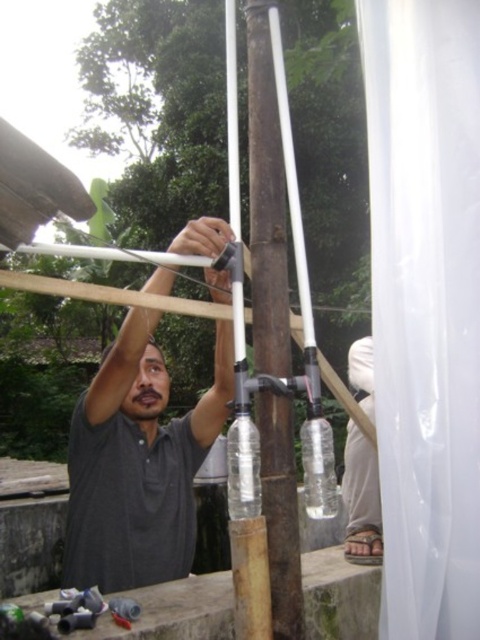
Question: Estimate the real-world distances between objects in this image. Which object is closer to the white sheer curtain at right?

Choices:
 (A) white plastic pole at center
 (B) dark gray shirt at center

Answer: (A)

Question: Which of the following is the farthest from the observer?

Choices:
 (A) dark gray skin at upper center
 (B) dark gray shirt at center
 (C) white sheer curtain at right
 (D) white plastic pole at center

Answer: (A)

Question: Does white sheer curtain at right appear under dark gray skin at upper center?

Choices:
 (A) no
 (B) yes

Answer: (A)

Question: Does dark gray shirt at center appear over white plastic pole at center?

Choices:
 (A) no
 (B) yes

Answer: (A)

Question: Which object appears farthest from the camera in this image?

Choices:
 (A) white plastic pole at center
 (B) dark gray skin at upper center
 (C) dark gray shirt at center
 (D) white sheer curtain at right

Answer: (B)

Question: Does dark gray shirt at center lie in front of dark gray skin at upper center?

Choices:
 (A) yes
 (B) no

Answer: (A)